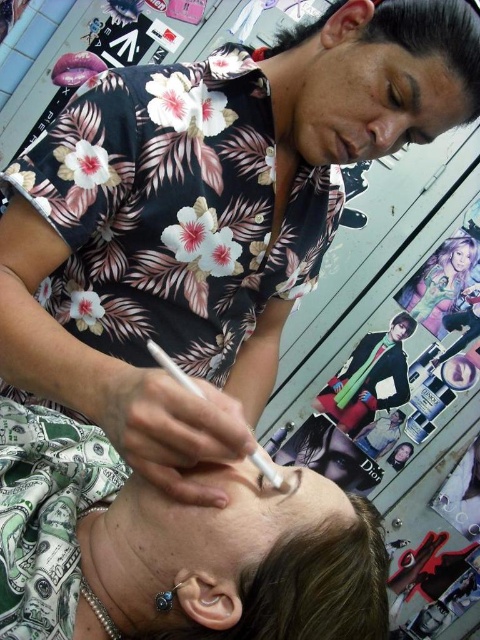
Is matte plastic poster at upper right above matte black mouth at upper center?

Actually, matte plastic poster at upper right is below matte black mouth at upper center.

Does matte plastic poster at upper right have a larger size compared to matte black mouth at upper center?

Correct, matte plastic poster at upper right is larger in size than matte black mouth at upper center.

Between point (436, 285) and point (343, 152), which one is positioned behind?

Positioned behind is point (436, 285).

Locate an element on the screen. matte plastic poster at upper right is located at coordinates (443, 282).

Between brown matte hair at lower center and matte black shirt at upper center, which one appears on the left side from the viewer's perspective?

Positioned to the left is brown matte hair at lower center.

Which is below, brown matte hair at lower center or matte black shirt at upper center?

matte black shirt at upper center is below.

Between point (263, 563) and point (381, 433), which one is positioned behind?

The point (381, 433) is behind.

Where is `brown matte hair at lower center`? brown matte hair at lower center is located at coordinates (311, 586).

Which is in front, point (356, 513) or point (419, 317)?

Point (356, 513) is more forward.

Does matte green dollar bill at lower left appear on the left side of matte plastic poster at upper right?

Indeed, matte green dollar bill at lower left is positioned on the left side of matte plastic poster at upper right.

In the scene shown: Measure the distance between matte green dollar bill at lower left and camera.

matte green dollar bill at lower left is 19.72 inches from camera.

At what (x,y) coordinates should I click in order to perform the action: click on matte green dollar bill at lower left. Please return your answer as a coordinate pair (x, y). This screenshot has height=640, width=480. Looking at the image, I should click on (176, 547).